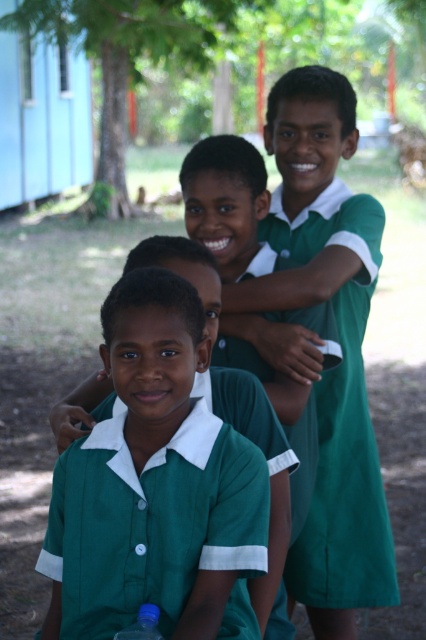
Looking at this image, you are a photographer trying to capture a group photo of the boys. You notice the green matte uniform at center and the blue plastic bottle at lower left. To ensure the bottle doesn not distract, should you adjust the camera angle to hide it behind the uniform?

The green matte uniform at center is located above the blue plastic bottle at lower left, so adjusting the camera angle to position the uniform in front of the bottle could effectively hide it from view.

You are a photographer trying to capture a clear shot of the two boys wearing the green uniform shirt at center and the green matte uniform at center. Which one should you focus on first to ensure they are both in focus?

You should focus on the green uniform shirt at center first since it is closer to the viewer than the green matte uniform at center, ensuring both will be in focus when starting with the closer one.